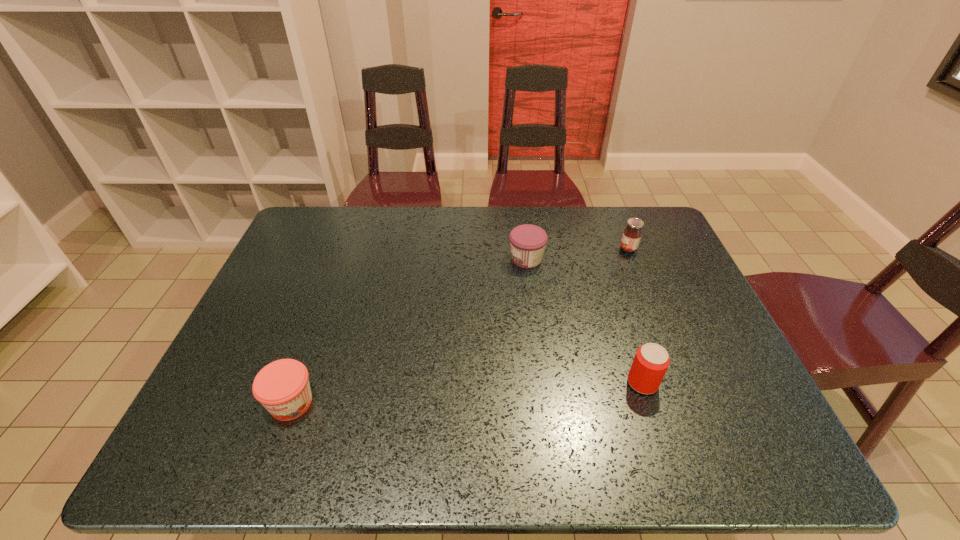
Locate an element on the screen. beer can is located at coordinates (651, 361).

Find the location of a particular element. The image size is (960, 540). the rightmost object is located at coordinates (632, 234).

Find the location of a particular element. This screenshot has height=540, width=960. the second object from left to right is located at coordinates (527, 241).

I want to click on the nearest jam, so click(282, 387).

Find the location of a particular element. the leftmost jam is located at coordinates (282, 387).

Locate an element on the screen. This screenshot has height=540, width=960. vacant space located on the left of the beer can is located at coordinates coord(532,383).

Identify the location of vacant space located on the label side of the rightmost object. (520, 249).

Identify the location of vacant space located 0.160m on the label side of the rightmost object. (568, 249).

You are a GUI agent. You are given a task and a screenshot of the screen. Output one action in this format:
    pyautogui.click(x=<x>, y=<y>)
    Task: Click on the vacant space located on the label side of the rightmost object
    Image resolution: width=960 pixels, height=540 pixels.
    Given the screenshot: What is the action you would take?
    pyautogui.click(x=492, y=249)

Image resolution: width=960 pixels, height=540 pixels. I want to click on vacant space positioned 0.330m on the front label of the third object from right to left, so click(400, 259).